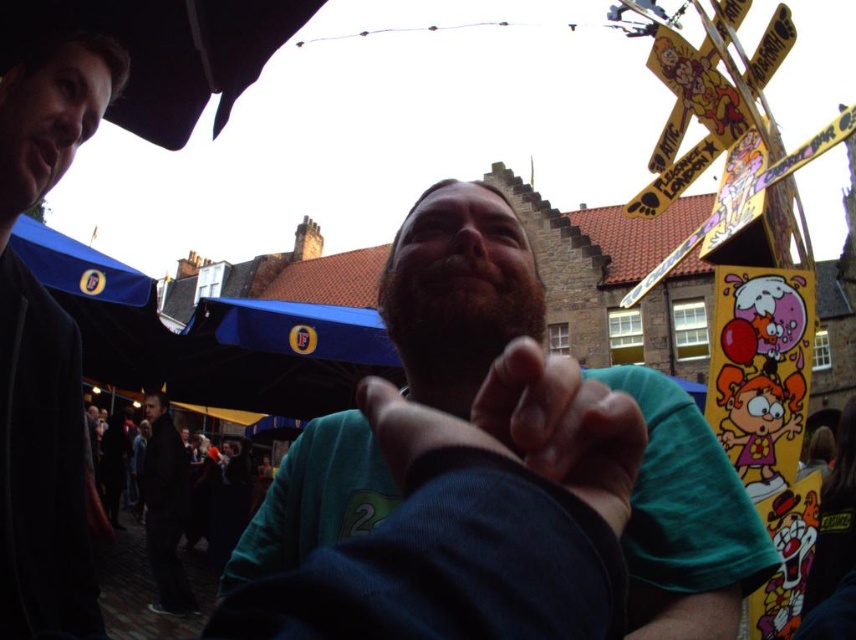
You are a photographer trying to capture a group photo of the green matte shirt at center and dark gray suit at lower left. Based on their positions, which one might require more space in the frame to avoid being cut off?

The green matte shirt at center might require more space in the frame since it is wider than the dark gray suit at lower left according to the description.